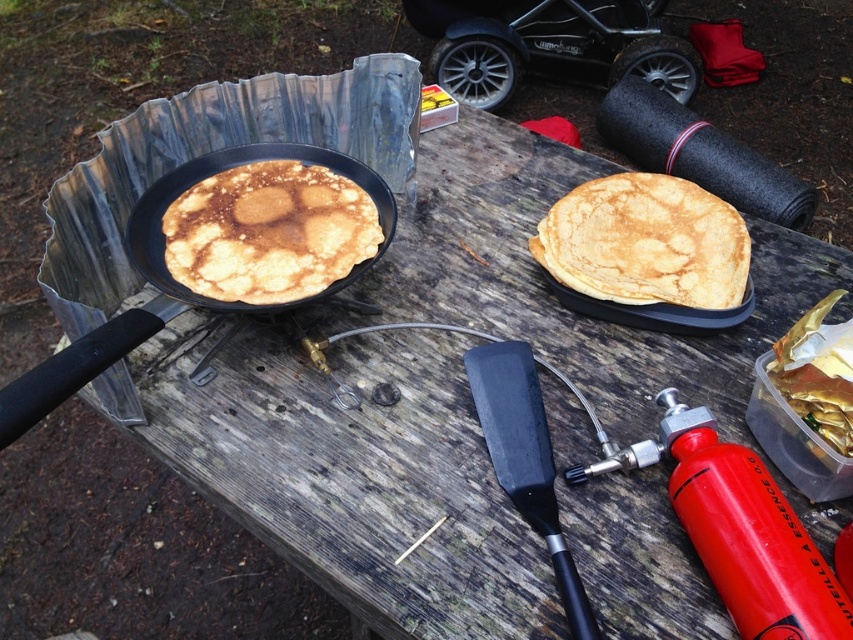
Between black rubber baby carriage at upper center and matte black frying pan at left, which one has less height?

matte black frying pan at left is shorter.

Describe the element at coordinates (548, 44) in the screenshot. The height and width of the screenshot is (640, 853). I see `black rubber baby carriage at upper center` at that location.

Describe the element at coordinates (548, 44) in the screenshot. I see `black rubber baby carriage at upper center` at that location.

Image resolution: width=853 pixels, height=640 pixels. I want to click on black rubber baby carriage at upper center, so click(548, 44).

Does point (189, 209) come closer to viewer compared to point (96, 356)?

That is False.

Is golden matte pancake at left wider than matte black frying pan at left?

No.

Between point (337, 228) and point (134, 344), which one is positioned behind?

The point (337, 228) is more distant.

Locate an element on the screen. The height and width of the screenshot is (640, 853). golden matte pancake at left is located at coordinates (270, 232).

Who is higher up, golden brown pancake at center or black rubber baby carriage at upper center?

Positioned higher is black rubber baby carriage at upper center.

Which is behind, point (544, 264) or point (451, 93)?

Positioned behind is point (451, 93).

The height and width of the screenshot is (640, 853). What are the coordinates of `golden brown pancake at center` in the screenshot? It's located at (645, 243).